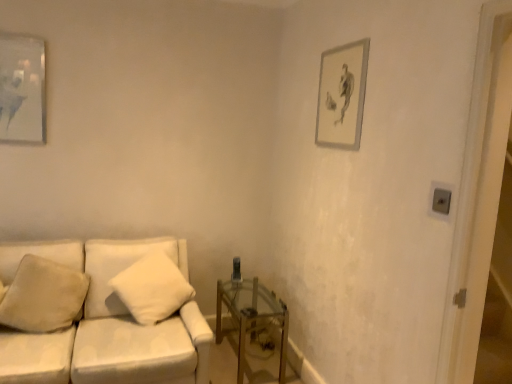
Locate an element on the screen. This screenshot has width=512, height=384. white soft pillow at center, acting as the first pillow starting from the right is located at coordinates (152, 288).

The image size is (512, 384). Describe the element at coordinates (342, 95) in the screenshot. I see `matte gray picture frame at upper right, the first picture frame viewed from the right` at that location.

Image resolution: width=512 pixels, height=384 pixels. What are the coordinates of `white soft pillow at center, arranged as the 2th pillow when viewed from the left` in the screenshot? It's located at coord(152,288).

Is matte gray picture frame at upper right, the first picture frame viewed from the right, inside the boundaries of transparent glass table at lower right, or outside?

The correct answer is: outside.

Between matte gray picture frame at upper right, the first picture frame viewed from the right, and transparent glass table at lower right, which one has larger size?

Bigger between the two is transparent glass table at lower right.

Where is `table below the matte gray picture frame at upper right, which ranks as the second picture frame in left-to-right order (from the image's perspective)`? This screenshot has height=384, width=512. table below the matte gray picture frame at upper right, which ranks as the second picture frame in left-to-right order (from the image's perspective) is located at coordinates (253, 323).

From the image's perspective, between beige soft pillow at lower left, which ranks as the 2th pillow in right-to-left order, and matte gray picture frame at upper right, which ranks as the second picture frame in left-to-right order, which one is located above?

matte gray picture frame at upper right, which ranks as the second picture frame in left-to-right order, from the image's perspective.

Considering the points (44, 292) and (341, 97), which point is in front, point (44, 292) or point (341, 97)?

Point (341, 97)

Is beige soft pillow at lower left, marked as the 1th pillow in a left-to-right arrangement, next to matte gray picture frame at upper right, which ranks as the second picture frame in left-to-right order?

There is a gap between beige soft pillow at lower left, marked as the 1th pillow in a left-to-right arrangement, and matte gray picture frame at upper right, which ranks as the second picture frame in left-to-right order.

What's the angular difference between matte gray picture frame at upper right, the first picture frame viewed from the right, and matte glass picture frame at upper left, which is counted as the 2th picture frame, starting from the right,'s facing directions?

88.4 degrees separate the facing orientations of matte gray picture frame at upper right, the first picture frame viewed from the right, and matte glass picture frame at upper left, which is counted as the 2th picture frame, starting from the right.

Considering the sizes of objects matte gray picture frame at upper right, which ranks as the second picture frame in left-to-right order, and matte glass picture frame at upper left, which is counted as the 2th picture frame, starting from the right, in the image provided, who is smaller, matte gray picture frame at upper right, which ranks as the second picture frame in left-to-right order, or matte glass picture frame at upper left, which is counted as the 2th picture frame, starting from the right,?

matte gray picture frame at upper right, which ranks as the second picture frame in left-to-right order, is smaller.

Is matte gray picture frame at upper right, the first picture frame viewed from the right, shorter than matte glass picture frame at upper left, the 1th picture frame in the left-to-right sequence?

Indeed, matte gray picture frame at upper right, the first picture frame viewed from the right, has a lesser height compared to matte glass picture frame at upper left, the 1th picture frame in the left-to-right sequence.

Consider the image. Considering the positions of objects matte gray picture frame at upper right, which ranks as the second picture frame in left-to-right order, and matte glass picture frame at upper left, the 1th picture frame in the left-to-right sequence, in the image provided, who is more to the right, matte gray picture frame at upper right, which ranks as the second picture frame in left-to-right order, or matte glass picture frame at upper left, the 1th picture frame in the left-to-right sequence,?

matte gray picture frame at upper right, which ranks as the second picture frame in left-to-right order, is more to the right.

Which object is thinner, transparent glass table at lower right or beige soft pillow at lower left, marked as the 1th pillow in a left-to-right arrangement?

With smaller width is beige soft pillow at lower left, marked as the 1th pillow in a left-to-right arrangement.

Would you say transparent glass table at lower right contains beige soft pillow at lower left, marked as the 1th pillow in a left-to-right arrangement?

No, beige soft pillow at lower left, marked as the 1th pillow in a left-to-right arrangement, is located outside of transparent glass table at lower right.

Does transparent glass table at lower right have a greater height compared to beige soft pillow at lower left, which ranks as the 2th pillow in right-to-left order?

Incorrect, the height of transparent glass table at lower right is not larger of that of beige soft pillow at lower left, which ranks as the 2th pillow in right-to-left order.

Is transparent glass table at lower right placed right next to beige soft pillow at lower left, marked as the 1th pillow in a left-to-right arrangement?

No.

Is white soft pillow at center, acting as the first pillow starting from the right, facing towards matte gray picture frame at upper right, the first picture frame viewed from the right?

No, white soft pillow at center, acting as the first pillow starting from the right, is not oriented towards matte gray picture frame at upper right, the first picture frame viewed from the right.

Between white soft pillow at center, arranged as the 2th pillow when viewed from the left, and matte gray picture frame at upper right, the first picture frame viewed from the right, which one has smaller size?

With smaller size is matte gray picture frame at upper right, the first picture frame viewed from the right.

Would you say white soft pillow at center, arranged as the 2th pillow when viewed from the left, is inside or outside matte gray picture frame at upper right, which ranks as the second picture frame in left-to-right order?

white soft pillow at center, arranged as the 2th pillow when viewed from the left, is not enclosed by matte gray picture frame at upper right, which ranks as the second picture frame in left-to-right order.

Which is closer to the camera, (357, 86) or (70, 376)?

The point (70, 376) is in front.

From a real-world perspective, is matte gray picture frame at upper right, which ranks as the second picture frame in left-to-right order, located higher than white fabric couch at center?

Indeed, from a real-world perspective, matte gray picture frame at upper right, which ranks as the second picture frame in left-to-right order, stands above white fabric couch at center.

At what (x,y) coordinates should I click in order to perform the action: click on picture frame that is on the right side of white fabric couch at center. Please return your answer as a coordinate pair (x, y). The width and height of the screenshot is (512, 384). Looking at the image, I should click on (342, 95).

Does matte gray picture frame at upper right, which ranks as the second picture frame in left-to-right order, turn towards white fabric couch at center?

No, matte gray picture frame at upper right, which ranks as the second picture frame in left-to-right order, is not turned towards white fabric couch at center.

Is point (118, 353) farther from camera compared to point (285, 348)?

No, (118, 353) is in front of (285, 348).

Is transparent glass table at lower right inside white fabric couch at center?

No, transparent glass table at lower right is not surrounded by white fabric couch at center.

How different are the orientations of white fabric couch at center and transparent glass table at lower right in degrees?

The facing directions of white fabric couch at center and transparent glass table at lower right are 1.35 degrees apart.

From a real-world perspective, which is physically below, white fabric couch at center or transparent glass table at lower right?

In real-world perspective, transparent glass table at lower right is lower.

Locate an element on the screen. The width and height of the screenshot is (512, 384). the 1st picture frame above when counting from the transparent glass table at lower right (from the image's perspective) is located at coordinates (342, 95).

Starting from the matte gray picture frame at upper right, the first picture frame viewed from the right, which pillow is the 2nd one to the left? Please provide its 2D coordinates.

[(42, 296)]

Based on their spatial positions, is white fabric couch at center or beige soft pillow at lower left, marked as the 1th pillow in a left-to-right arrangement, closer to matte gray picture frame at upper right, which ranks as the second picture frame in left-to-right order?

white fabric couch at center lies closer to matte gray picture frame at upper right, which ranks as the second picture frame in left-to-right order, than the other object.

When comparing their distances from transparent glass table at lower right, does white soft pillow at center, arranged as the 2th pillow when viewed from the left, or matte glass picture frame at upper left, the 1th picture frame in the left-to-right sequence, seem closer?

white soft pillow at center, arranged as the 2th pillow when viewed from the left, lies closer to transparent glass table at lower right than the other object.

Which object lies further to the anchor point transparent glass table at lower right, beige soft pillow at lower left, which ranks as the 2th pillow in right-to-left order, or matte glass picture frame at upper left, the 1th picture frame in the left-to-right sequence?

matte glass picture frame at upper left, the 1th picture frame in the left-to-right sequence, lies further to transparent glass table at lower right than the other object.

Based on their spatial positions, is transparent glass table at lower right or matte gray picture frame at upper right, the first picture frame viewed from the right, closer to beige soft pillow at lower left, marked as the 1th pillow in a left-to-right arrangement?

transparent glass table at lower right lies closer to beige soft pillow at lower left, marked as the 1th pillow in a left-to-right arrangement, than the other object.

Looking at the image, which one is located further to white soft pillow at center, acting as the first pillow starting from the right, transparent glass table at lower right or beige soft pillow at lower left, which ranks as the 2th pillow in right-to-left order?

transparent glass table at lower right is further to white soft pillow at center, acting as the first pillow starting from the right.

Estimate the real-world distances between objects in this image. Which object is further from white fabric couch at center, beige soft pillow at lower left, marked as the 1th pillow in a left-to-right arrangement, or transparent glass table at lower right?

transparent glass table at lower right.

Looking at the image, which one is located further to matte gray picture frame at upper right, which ranks as the second picture frame in left-to-right order, beige soft pillow at lower left, marked as the 1th pillow in a left-to-right arrangement, or transparent glass table at lower right?

The object further to matte gray picture frame at upper right, which ranks as the second picture frame in left-to-right order, is beige soft pillow at lower left, marked as the 1th pillow in a left-to-right arrangement.

Looking at the image, which one is located closer to white soft pillow at center, acting as the first pillow starting from the right, transparent glass table at lower right or white fabric couch at center?

white fabric couch at center lies closer to white soft pillow at center, acting as the first pillow starting from the right, than the other object.

This screenshot has width=512, height=384. What are the coordinates of `pillow located between white fabric couch at center and transparent glass table at lower right in the left-right direction` in the screenshot? It's located at (152, 288).

Locate an element on the screen. The width and height of the screenshot is (512, 384). pillow between matte glass picture frame at upper left, the 1th picture frame in the left-to-right sequence, and beige soft pillow at lower left, which ranks as the 2th pillow in right-to-left order, vertically is located at coordinates (152, 288).

The image size is (512, 384). I want to click on pillow between beige soft pillow at lower left, which ranks as the 2th pillow in right-to-left order, and transparent glass table at lower right from left to right, so (152, 288).

At what (x,y) coordinates should I click in order to perform the action: click on pillow between white fabric couch at center and white soft pillow at center, arranged as the 2th pillow when viewed from the left, along the z-axis. Please return your answer as a coordinate pair (x, y). Looking at the image, I should click on (42, 296).